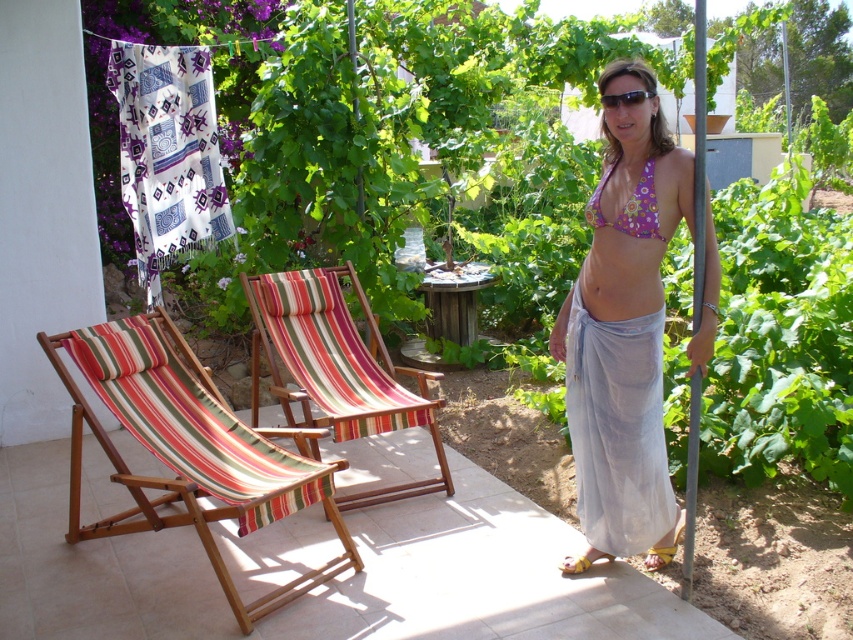
Question: Can you confirm if floral print fabric bikini top at upper right is positioned to the left of yellow fabric sandal at lower right?

Choices:
 (A) no
 (B) yes

Answer: (A)

Question: Can you confirm if striped fabric beach chair at center is smaller than sunglasses at center?

Choices:
 (A) yes
 (B) no

Answer: (B)

Question: Does metallic pole at right have a larger size compared to yellow fabric sandal at lower right?

Choices:
 (A) no
 (B) yes

Answer: (B)

Question: Which object appears farthest from the camera in this image?

Choices:
 (A) yellow fabric sandal at lower right
 (B) sunglasses at center
 (C) floral print fabric bikini top at upper right

Answer: (A)

Question: Estimate the real-world distances between objects in this image. Which object is closer to the striped fabric beach chair at left?

Choices:
 (A) metallic pole at right
 (B) translucent white bikini bottom at right

Answer: (B)

Question: Which point is closer to the camera taking this photo?

Choices:
 (A) (140, 381)
 (B) (672, 509)
 (C) (560, 566)
 (D) (698, 45)

Answer: (D)